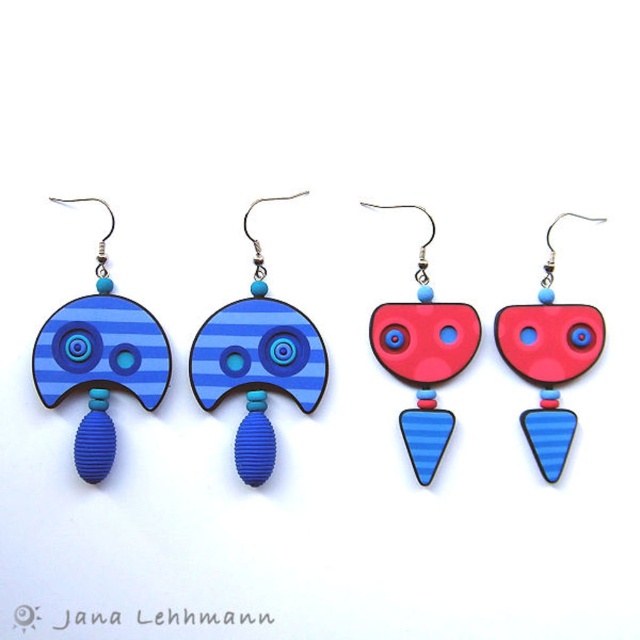
Question: Is blue striped wood at center thinner than matte blue wood earring at center?

Choices:
 (A) no
 (B) yes

Answer: (A)

Question: Which point is closer to the camera?

Choices:
 (A) matte blue wood earring at left
 (B) blue striped wood at center

Answer: (A)

Question: Is matte blue wood earring at left smaller than matte blue wood earring at center?

Choices:
 (A) yes
 (B) no

Answer: (B)

Question: Which object is positioned farthest from the blue striped wood at center?

Choices:
 (A) matte red plastic heart at center
 (B) matte blue wood earring at left
 (C) matte blue wood earring at center

Answer: (A)

Question: Which point is closer to the camera?

Choices:
 (A) (145, 376)
 (B) (570, 321)

Answer: (A)

Question: Is the position of matte blue wood earring at center less distant than that of matte red plastic heart at center?

Choices:
 (A) no
 (B) yes

Answer: (A)